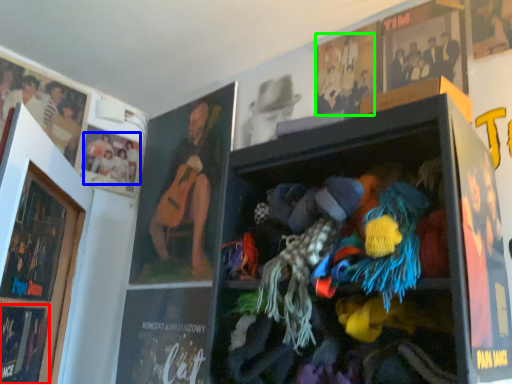
Question: Which object is positioned farthest from magazine (highlighted by a red box)? Select from person (highlighted by a blue box) and person (highlighted by a green box).

Choices:
 (A) person
 (B) person

Answer: (B)